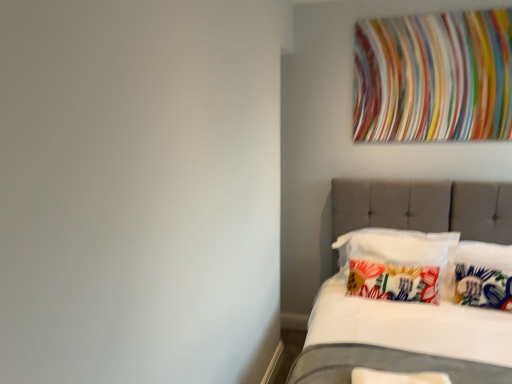
Where is `free spot above multicolored fabric at upper right (from a real-world perspective)`? The width and height of the screenshot is (512, 384). free spot above multicolored fabric at upper right (from a real-world perspective) is located at coordinates (431, 7).